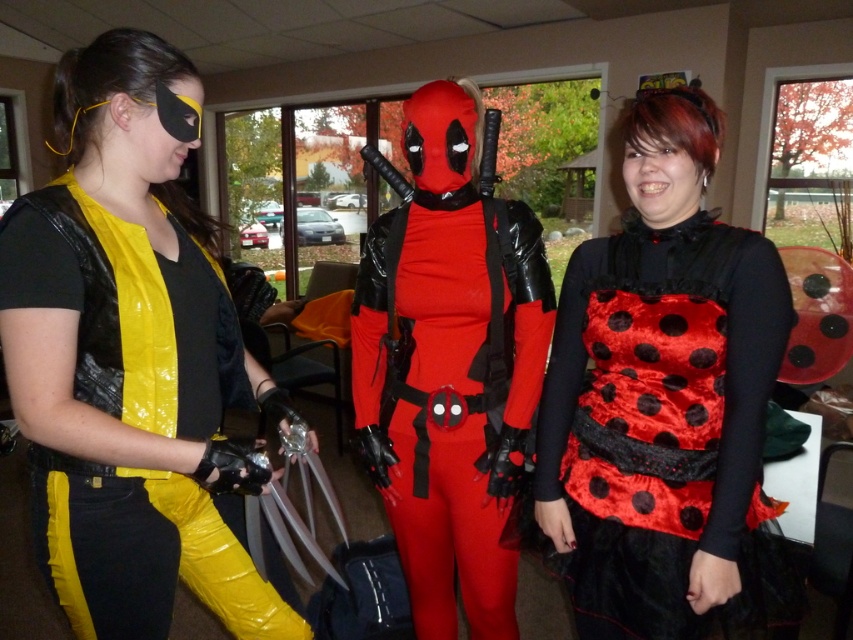
You are a photographer at the event and want to capture a photo of the shiny yellow vest at left and the velvet polka dot dress at center. Which object is closer to the camera?

The shiny yellow vest at left is in front of the velvet polka dot dress at center, so it is closer to the camera.